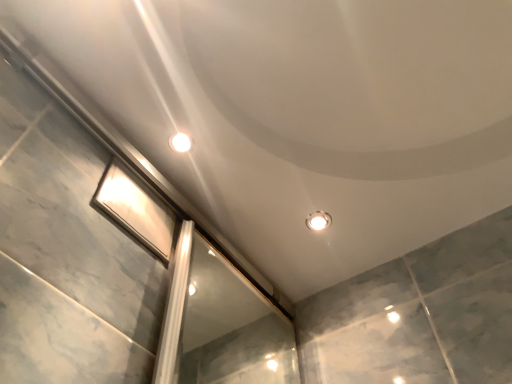
This screenshot has height=384, width=512. Identify the location of white glossy window at upper left. (136, 209).

Describe the element at coordinates (136, 209) in the screenshot. The width and height of the screenshot is (512, 384). I see `white glossy window at upper left` at that location.

You are a GUI agent. You are given a task and a screenshot of the screen. Output one action in this format:
    pyautogui.click(x=<x>, y=<y>)
    Task: Click on the white glossy window at upper left
    This screenshot has height=384, width=512.
    Given the screenshot: What is the action you would take?
    pyautogui.click(x=136, y=209)